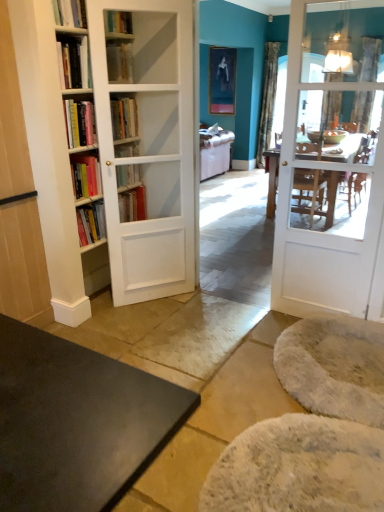
The width and height of the screenshot is (384, 512). Identify the location of empty space that is to the right of white glossy bookcase at left. (193, 308).